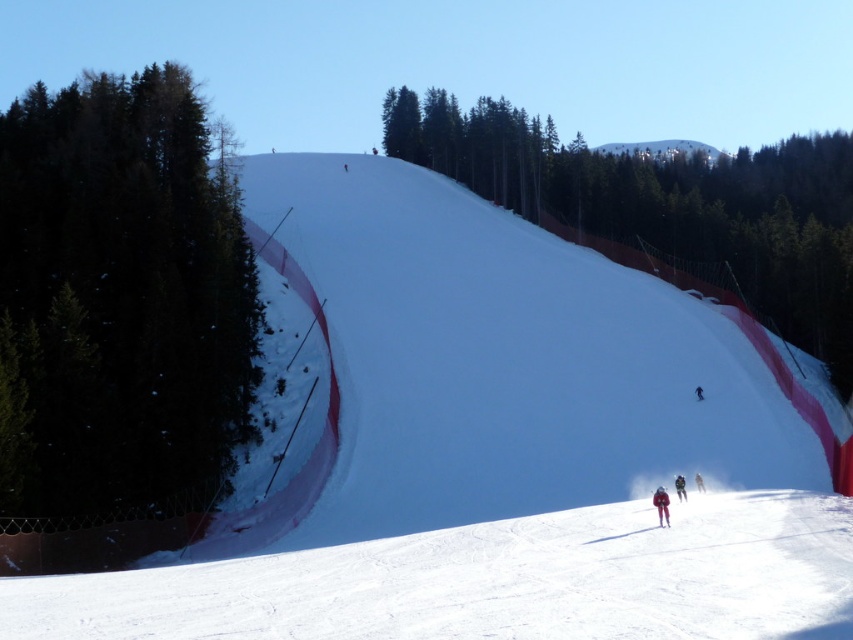
Question: Is dark blue ski suit at center thinner than white matte ski at center?

Choices:
 (A) no
 (B) yes

Answer: (A)

Question: Estimate the real-world distances between objects in this image. Which object is farther from the green matte tree at center?

Choices:
 (A) black matte skier at center
 (B) red ski suit at center
 (C) green matte tree at left
 (D) dark blue ski suit at center

Answer: (B)

Question: Among these points, which one is nearest to the camera?

Choices:
 (A) (666, 518)
 (B) (701, 490)

Answer: (A)

Question: Does red ski suit at center have a larger size compared to white matte ski at center?

Choices:
 (A) no
 (B) yes

Answer: (B)

Question: Does dark blue ski suit at center appear over black matte skier at center?

Choices:
 (A) yes
 (B) no

Answer: (B)

Question: Which object appears farthest from the camera in this image?

Choices:
 (A) black matte skier at center
 (B) green matte tree at left
 (C) white smooth snow at center
 (D) red ski suit at center

Answer: (A)